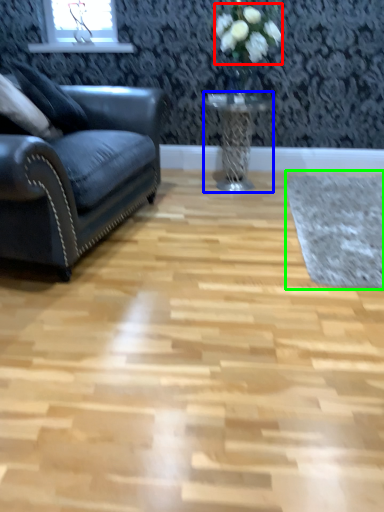
Question: Which object is positioned farthest from flower (highlighted by a red box)? Select from table (highlighted by a blue box) and mat (highlighted by a green box).

Choices:
 (A) table
 (B) mat

Answer: (B)